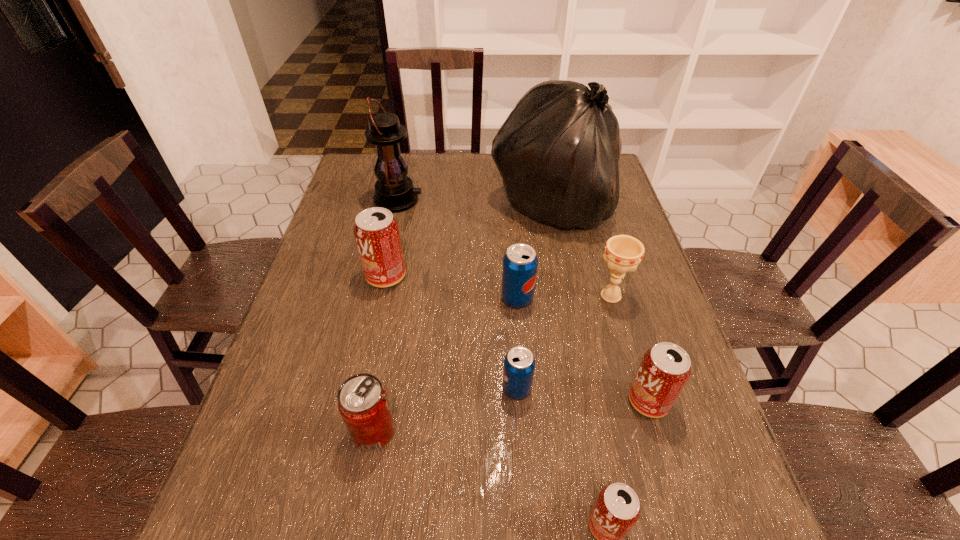
Where is `the tallest object`? The width and height of the screenshot is (960, 540). the tallest object is located at coordinates (558, 152).

You are a GUI agent. You are given a task and a screenshot of the screen. Output one action in this format:
    pyautogui.click(x=<x>, y=<y>)
    Task: Click on the lantern
    The height and width of the screenshot is (540, 960).
    Given the screenshot: What is the action you would take?
    pyautogui.click(x=394, y=190)

The width and height of the screenshot is (960, 540). Identify the location of the second tallest object. (394, 190).

You are a GUI agent. You are given a task and a screenshot of the screen. Output one action in this format:
    pyautogui.click(x=<x>, y=<y>)
    Task: Click on the biggest red soda can
    The width and height of the screenshot is (960, 540).
    Given the screenshot: What is the action you would take?
    pyautogui.click(x=376, y=231)

What are the coordinates of `the farthest red soda can` in the screenshot? It's located at (376, 231).

Where is `chalice`? This screenshot has width=960, height=540. chalice is located at coordinates (623, 253).

The height and width of the screenshot is (540, 960). I want to click on the bigger blue pop soda, so click(520, 262).

This screenshot has width=960, height=540. Identify the location of the rightmost soda can. (665, 368).

Identify the location of the nearer blue pop soda. The height and width of the screenshot is (540, 960). (519, 365).

You are a GUI agent. You are given a task and a screenshot of the screen. Output one action in this format:
    pyautogui.click(x=<x>, y=<y>)
    Task: Click on the vacant space located on the front of the tallest object
    The height and width of the screenshot is (540, 960).
    Given the screenshot: What is the action you would take?
    pyautogui.click(x=577, y=330)